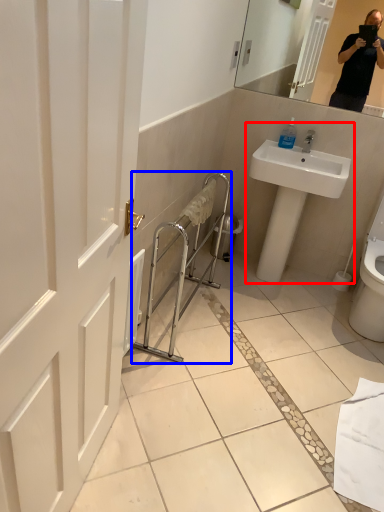
Question: Which object appears farthest to the camera in this image, sink (highlighted by a red box) or balustrade (highlighted by a blue box)?

Choices:
 (A) sink
 (B) balustrade

Answer: (A)